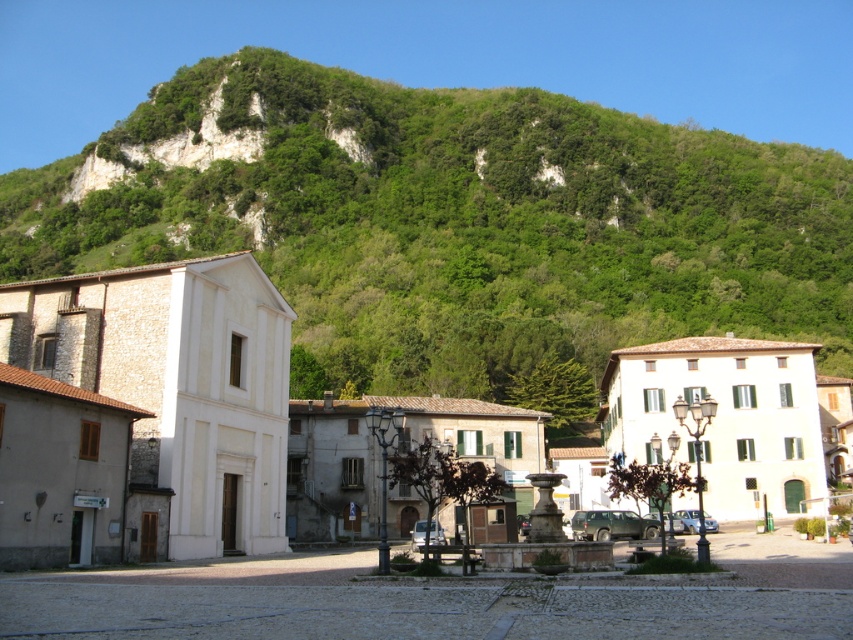
Based on the photo, you are an architect visiting the town square and want to assess the visual balance between the green leafy hillside at upper center and the white stone building at center. Which one takes up more space in the scene?

The green leafy hillside at upper center takes up more space in the scene than the white stone building at center because it is bigger.

You are standing in the town square and want to take a photo of the white stone building at center. To avoid including the green leafy hillside at upper center in your photo, where should you position yourself relative to the building?

You should position yourself below the white stone building at center because the green leafy hillside at upper center is above it, so moving lower will exclude the hillside from the frame.